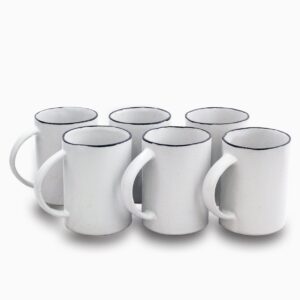
What are the coordinates of `cup` in the screenshot? It's located at pyautogui.click(x=79, y=170), pyautogui.click(x=174, y=182), pyautogui.click(x=247, y=182), pyautogui.click(x=215, y=132), pyautogui.click(x=134, y=127), pyautogui.click(x=50, y=135).